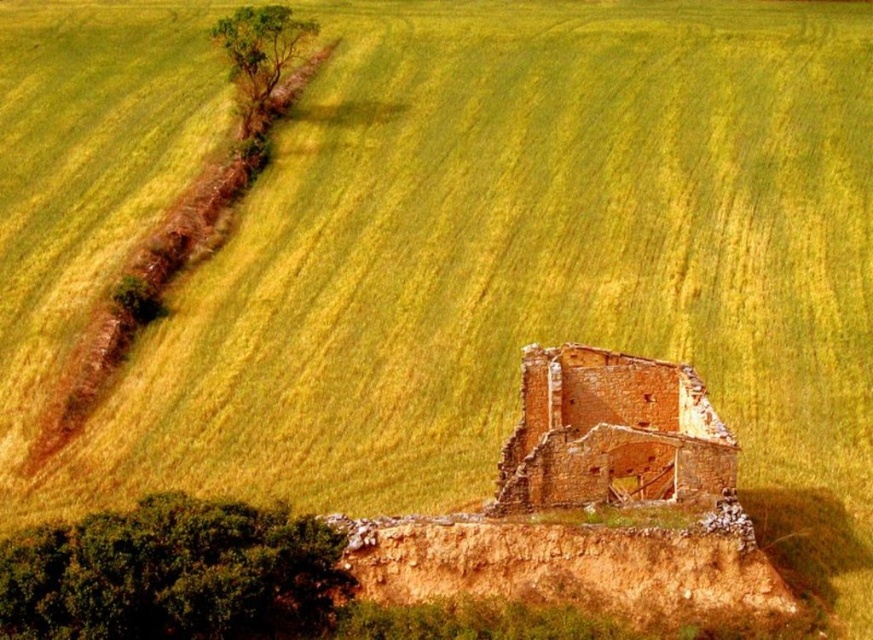
The width and height of the screenshot is (873, 640). What do you see at coordinates (172, 573) in the screenshot?
I see `green leafy tree at lower left` at bounding box center [172, 573].

Does green leafy tree at lower left have a greater height compared to green leafy tree at upper left?

No, green leafy tree at lower left is not taller than green leafy tree at upper left.

Between point (122, 577) and point (283, 36), which one is positioned behind?

The point (283, 36) is more distant.

At what (x,y) coordinates should I click in order to perform the action: click on green leafy tree at lower left. Please return your answer as a coordinate pair (x, y). The width and height of the screenshot is (873, 640). Looking at the image, I should click on (172, 573).

Is green leafy tree at lower left closer to the viewer compared to brick wall ruins at center?

Yes, green leafy tree at lower left is closer to the viewer.

Between point (170, 557) and point (603, 400), which one is positioned in front?

Point (170, 557) is in front.

Is point (272, 627) positioned in front of point (576, 438)?

Yes.

Identify the location of green leafy tree at lower left. This screenshot has height=640, width=873. (172, 573).

The width and height of the screenshot is (873, 640). Describe the element at coordinates (610, 432) in the screenshot. I see `brick wall ruins at center` at that location.

Is brick wall ruins at center smaller than green leafy tree at upper left?

Correct, brick wall ruins at center occupies less space than green leafy tree at upper left.

Where is `brick wall ruins at center`? The width and height of the screenshot is (873, 640). brick wall ruins at center is located at coordinates click(610, 432).

At what (x,y) coordinates should I click in order to perform the action: click on brick wall ruins at center. Please return your answer as a coordinate pair (x, y). This screenshot has width=873, height=640. Looking at the image, I should click on click(610, 432).